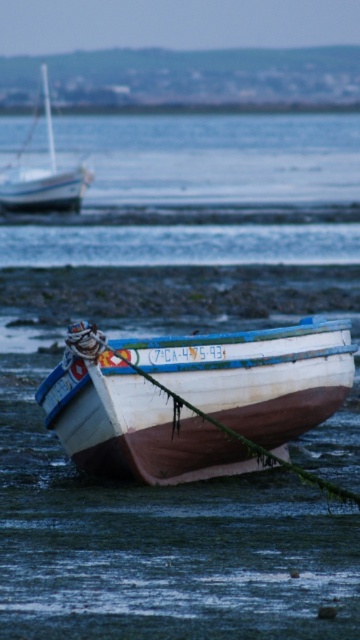
Question: Is wooden boat at lower center above white matte sailboat at upper left?

Choices:
 (A) no
 (B) yes

Answer: (A)

Question: Is wooden boat at lower center to the left of white matte sailboat at upper left from the viewer's perspective?

Choices:
 (A) yes
 (B) no

Answer: (B)

Question: Does wooden boat at lower center have a greater width compared to white matte sailboat at upper left?

Choices:
 (A) no
 (B) yes

Answer: (A)

Question: Which point is closer to the camera taking this photo?

Choices:
 (A) (25, 179)
 (B) (133, 467)

Answer: (B)

Question: Which point is closer to the camera?

Choices:
 (A) (339, 321)
 (B) (23, 195)

Answer: (A)

Question: Which point appears closest to the camera in this image?

Choices:
 (A) (168, 454)
 (B) (47, 76)

Answer: (A)